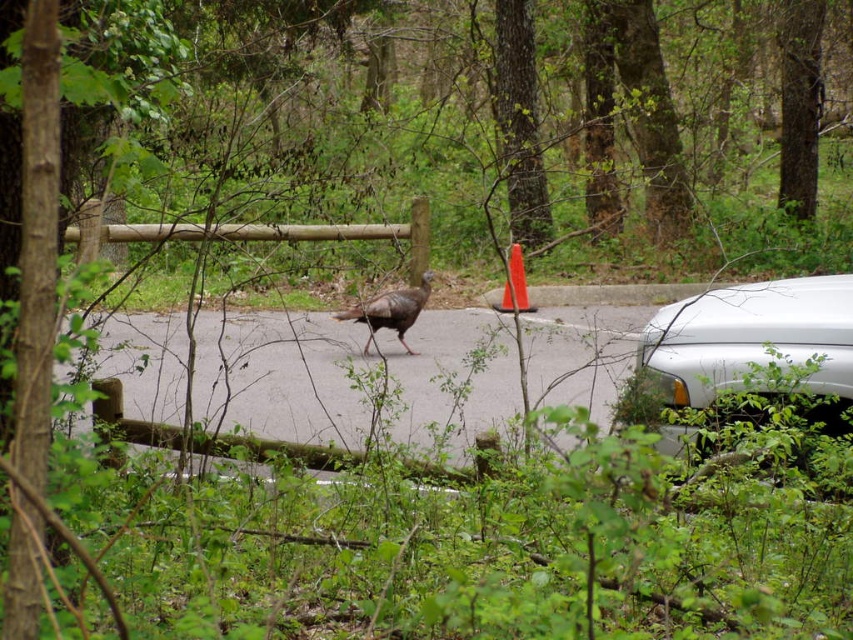
Question: Which object is positioned closest to the white glossy car at right?

Choices:
 (A) brown feathered turkey at center
 (B) orange plastic traffic cone at center

Answer: (B)

Question: Can you confirm if brown feathered turkey at center is positioned to the left of orange plastic traffic cone at center?

Choices:
 (A) yes
 (B) no

Answer: (A)

Question: Considering the real-world distances, which object is closest to the brown feathered turkey at center?

Choices:
 (A) orange plastic traffic cone at center
 (B) white glossy car at right

Answer: (A)

Question: Which point is farther from the camera taking this photo?

Choices:
 (A) (509, 248)
 (B) (751, 317)
 (C) (412, 292)

Answer: (A)

Question: Observing the image, what is the correct spatial positioning of white glossy car at right in reference to orange plastic traffic cone at center?

Choices:
 (A) above
 (B) below

Answer: (B)

Question: Is brown feathered turkey at center below orange plastic traffic cone at center?

Choices:
 (A) yes
 (B) no

Answer: (A)